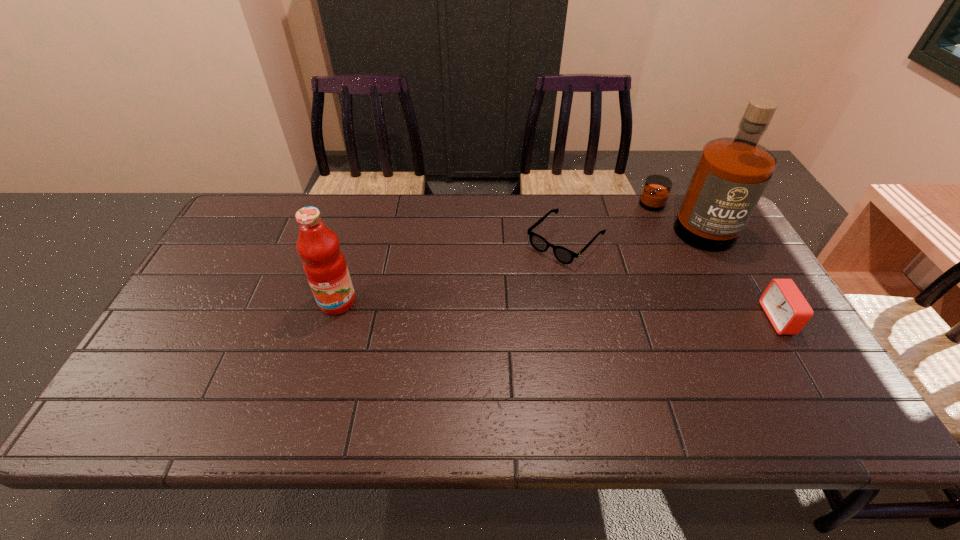
The image size is (960, 540). In order to click on vacant space that satisfies the following two spatial constraints: 1. on the front side of the spectacles; 2. on the front-facing side of the third tallest object in this screenshot , I will do `click(581, 319)`.

You are a GUI agent. You are given a task and a screenshot of the screen. Output one action in this format:
    pyautogui.click(x=<x>, y=<y>)
    Task: Click on the vacant space that satisfies the following two spatial constraints: 1. on the front label of the third shortest object; 2. on the front-facing side of the alarm clock
    Image resolution: width=960 pixels, height=540 pixels.
    Given the screenshot: What is the action you would take?
    pyautogui.click(x=332, y=319)

I want to click on vacant space that satisfies the following two spatial constraints: 1. on the back side of the shortest object; 2. on the left side of the liquor, so [x=562, y=222].